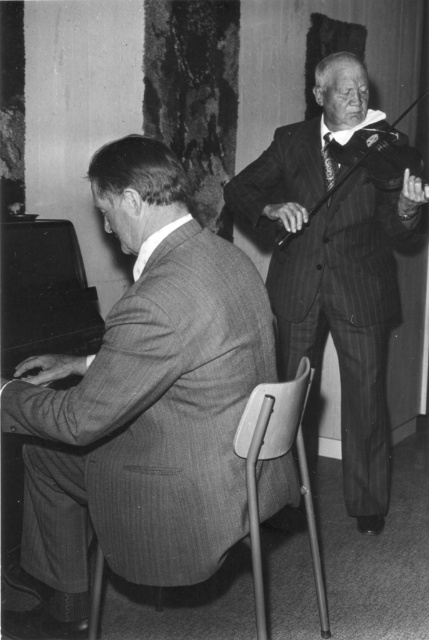
Question: Is metallic gray chair at center positioned in front of wooden violin at upper right?

Choices:
 (A) yes
 (B) no

Answer: (A)

Question: In this image, where is striped suit at left located relative to wooden violin at upper right?

Choices:
 (A) left
 (B) right

Answer: (A)

Question: Which point appears farthest from the camera in this image?

Choices:
 (A) (419, 99)
 (B) (360, 442)
 (C) (307, 476)

Answer: (B)

Question: Based on their relative distances, which object is farther from the pinstriped suit at right?

Choices:
 (A) wooden violin at upper right
 (B) metallic gray chair at center

Answer: (B)

Question: Which object appears closest to the camera in this image?

Choices:
 (A) pinstriped suit at right
 (B) metallic gray chair at center

Answer: (B)

Question: Is the position of pinstriped suit at right less distant than that of wooden violin at upper right?

Choices:
 (A) yes
 (B) no

Answer: (A)